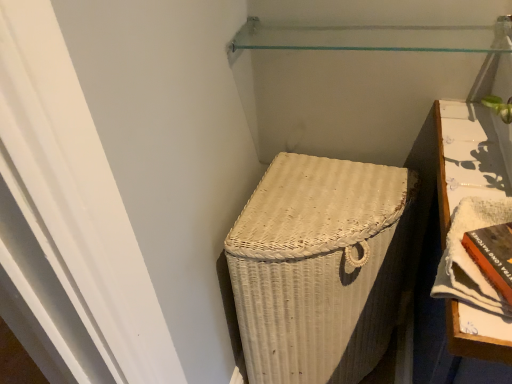
What do you see at coordinates (470, 257) in the screenshot? The width and height of the screenshot is (512, 384). I see `orange hardcover book at right, positioned as the 1th book in right-to-left order` at bounding box center [470, 257].

The image size is (512, 384). What do you see at coordinates (376, 37) in the screenshot?
I see `transparent glass shelf at upper center` at bounding box center [376, 37].

Where is `white wicker basket at lower right`? white wicker basket at lower right is located at coordinates (319, 268).

Describe the element at coordinates (319, 268) in the screenshot. This screenshot has width=512, height=384. I see `white wicker basket at lower right` at that location.

Locate an element on the screen. The image size is (512, 384). orange hardcover book at right, positioned as the 1th book in right-to-left order is located at coordinates pos(470,257).

Can you confirm if white wicker basket at lower right is wider than orange hardcover book at right, positioned as the 1th book in right-to-left order?

Yes, white wicker basket at lower right is wider than orange hardcover book at right, positioned as the 1th book in right-to-left order.

Which object is positioned more to the left, white wicker basket at lower right or orange hardcover book at right, marked as the second book in a left-to-right arrangement?

white wicker basket at lower right.

Does white wicker basket at lower right have a greater height compared to orange hardcover book at right, marked as the second book in a left-to-right arrangement?

Correct, white wicker basket at lower right is much taller as orange hardcover book at right, marked as the second book in a left-to-right arrangement.

From a real-world perspective, is white wicker basket at lower right physically below orange hardcover book at right, marked as the second book in a left-to-right arrangement?

Indeed, from a real-world perspective, white wicker basket at lower right is positioned beneath orange hardcover book at right, marked as the second book in a left-to-right arrangement.

Does point (477, 237) come behind point (468, 205)?

No, (477, 237) is closer to viewer.

Would you say orange hardcover book at lower right, which appears as the 1th book when viewed from the left, is inside or outside orange hardcover book at right, marked as the second book in a left-to-right arrangement?

orange hardcover book at lower right, which appears as the 1th book when viewed from the left, fits inside orange hardcover book at right, marked as the second book in a left-to-right arrangement.

Considering the relative sizes of orange hardcover book at lower right, which appears as the 1th book when viewed from the left, and orange hardcover book at right, positioned as the 1th book in right-to-left order, in the image provided, is orange hardcover book at lower right, which appears as the 1th book when viewed from the left, smaller than orange hardcover book at right, positioned as the 1th book in right-to-left order,?

Correct, orange hardcover book at lower right, which appears as the 1th book when viewed from the left, occupies less space than orange hardcover book at right, positioned as the 1th book in right-to-left order.

Image resolution: width=512 pixels, height=384 pixels. Identify the location of book on the left of orange hardcover book at right, positioned as the 1th book in right-to-left order. (493, 255).

Would you say white wicker basket at lower right is a long distance from orange hardcover book at lower right, which appears as the 1th book when viewed from the left?

They are positioned close to each other.

From a real-world perspective, is white wicker basket at lower right located higher than orange hardcover book at lower right, which appears as the 1th book when viewed from the left?

Incorrect, from a real-world perspective, white wicker basket at lower right is lower than orange hardcover book at lower right, which appears as the 1th book when viewed from the left.

Measure the distance between white wicker basket at lower right and orange hardcover book at lower right, the 2th book from the right.

white wicker basket at lower right is 45.67 centimeters from orange hardcover book at lower right, the 2th book from the right.

Is white wicker basket at lower right oriented towards orange hardcover book at lower right, the 2th book from the right?

No, white wicker basket at lower right is not aimed at orange hardcover book at lower right, the 2th book from the right.

Is white wicker basket at lower right positioned with its back to transparent glass shelf at upper center?

No, white wicker basket at lower right is not facing away from transparent glass shelf at upper center.

Who is taller, white wicker basket at lower right or transparent glass shelf at upper center?

white wicker basket at lower right is taller.

Between white wicker basket at lower right and transparent glass shelf at upper center, which one appears on the right side from the viewer's perspective?

Positioned to the right is transparent glass shelf at upper center.

Would you say transparent glass shelf at upper center is part of white wicker basket at lower right's contents?

Definitely not — transparent glass shelf at upper center is not inside white wicker basket at lower right.

Looking at this image, how much distance is there between orange hardcover book at right, positioned as the 1th book in right-to-left order, and orange hardcover book at lower right, the 2th book from the right?

orange hardcover book at right, positioned as the 1th book in right-to-left order, and orange hardcover book at lower right, the 2th book from the right, are 3.01 centimeters apart.

Is orange hardcover book at right, positioned as the 1th book in right-to-left order, not close to orange hardcover book at lower right, the 2th book from the right?

orange hardcover book at right, positioned as the 1th book in right-to-left order, is actually quite close to orange hardcover book at lower right, the 2th book from the right.

From a real-world perspective, who is located lower, orange hardcover book at right, positioned as the 1th book in right-to-left order, or orange hardcover book at lower right, the 2th book from the right?

orange hardcover book at lower right, the 2th book from the right, from a real-world perspective.

Between orange hardcover book at right, marked as the second book in a left-to-right arrangement, and orange hardcover book at lower right, the 2th book from the right, which one has larger size?

Bigger between the two is orange hardcover book at right, marked as the second book in a left-to-right arrangement.

Can white wicker basket at lower right be found inside transparent glass shelf at upper center?

Definitely not — white wicker basket at lower right is not inside transparent glass shelf at upper center.

Considering the positions of objects transparent glass shelf at upper center and white wicker basket at lower right in the image provided, who is in front, transparent glass shelf at upper center or white wicker basket at lower right?

transparent glass shelf at upper center.

At what (x,y) coordinates should I click in order to perform the action: click on shelf in front of the white wicker basket at lower right. Please return your answer as a coordinate pair (x, y). Looking at the image, I should click on (376, 37).

Is transparent glass shelf at upper center shorter than orange hardcover book at right, positioned as the 1th book in right-to-left order?

Yes.

Can you confirm if transparent glass shelf at upper center is thinner than orange hardcover book at right, marked as the second book in a left-to-right arrangement?

Indeed, transparent glass shelf at upper center has a lesser width compared to orange hardcover book at right, marked as the second book in a left-to-right arrangement.

Considering the sizes of objects transparent glass shelf at upper center and orange hardcover book at right, positioned as the 1th book in right-to-left order, in the image provided, who is smaller, transparent glass shelf at upper center or orange hardcover book at right, positioned as the 1th book in right-to-left order,?

With smaller size is transparent glass shelf at upper center.

From the image's perspective, which book is the 2nd one above the white wicker basket at lower right? Please provide its 2D coordinates.

[(470, 257)]

Find the location of a particular element. This screenshot has width=512, height=384. book that appears in front of the orange hardcover book at lower right, which appears as the 1th book when viewed from the left is located at coordinates (470, 257).

Which object lies further to the anchor point transparent glass shelf at upper center, orange hardcover book at right, positioned as the 1th book in right-to-left order, or orange hardcover book at lower right, the 2th book from the right?

orange hardcover book at lower right, the 2th book from the right, is further to transparent glass shelf at upper center.

When comparing their distances from transparent glass shelf at upper center, does orange hardcover book at right, positioned as the 1th book in right-to-left order, or white wicker basket at lower right seem closer?

orange hardcover book at right, positioned as the 1th book in right-to-left order, is closer to transparent glass shelf at upper center.

Considering their positions, is orange hardcover book at lower right, which appears as the 1th book when viewed from the left, positioned further to transparent glass shelf at upper center than orange hardcover book at right, positioned as the 1th book in right-to-left order?

Among the two, orange hardcover book at lower right, which appears as the 1th book when viewed from the left, is located further to transparent glass shelf at upper center.

Looking at the image, which one is located closer to transparent glass shelf at upper center, white wicker basket at lower right or orange hardcover book at lower right, which appears as the 1th book when viewed from the left?

white wicker basket at lower right lies closer to transparent glass shelf at upper center than the other object.

From the image, which object appears to be nearer to orange hardcover book at right, positioned as the 1th book in right-to-left order, orange hardcover book at lower right, the 2th book from the right, or transparent glass shelf at upper center?

orange hardcover book at lower right, the 2th book from the right, is positioned closer to the anchor orange hardcover book at right, positioned as the 1th book in right-to-left order.

From the image, which object appears to be farther from orange hardcover book at lower right, which appears as the 1th book when viewed from the left, orange hardcover book at right, marked as the second book in a left-to-right arrangement, or white wicker basket at lower right?

The object further to orange hardcover book at lower right, which appears as the 1th book when viewed from the left, is white wicker basket at lower right.

When comparing their distances from orange hardcover book at lower right, which appears as the 1th book when viewed from the left, does transparent glass shelf at upper center or orange hardcover book at right, marked as the second book in a left-to-right arrangement, seem further?

transparent glass shelf at upper center is further to orange hardcover book at lower right, which appears as the 1th book when viewed from the left.

Estimate the real-world distances between objects in this image. Which object is closer to orange hardcover book at lower right, which appears as the 1th book when viewed from the left, orange hardcover book at right, positioned as the 1th book in right-to-left order, or transparent glass shelf at upper center?

The object closer to orange hardcover book at lower right, which appears as the 1th book when viewed from the left, is orange hardcover book at right, positioned as the 1th book in right-to-left order.

The width and height of the screenshot is (512, 384). In order to click on book between transparent glass shelf at upper center and orange hardcover book at lower right, the 2th book from the right, in the up-down direction in this screenshot , I will do `click(470, 257)`.

The image size is (512, 384). In order to click on book positioned between orange hardcover book at right, positioned as the 1th book in right-to-left order, and white wicker basket at lower right from near to far in this screenshot , I will do `click(493, 255)`.